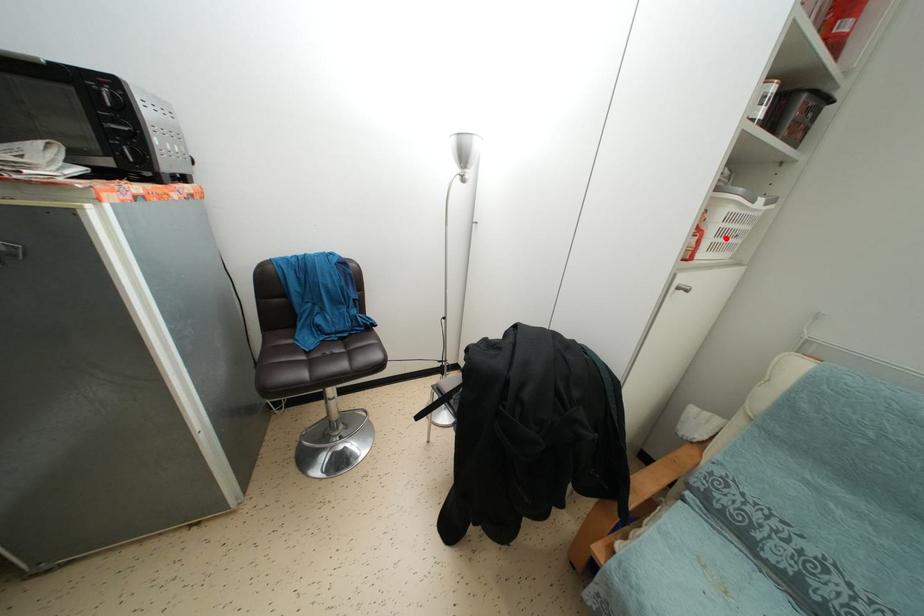
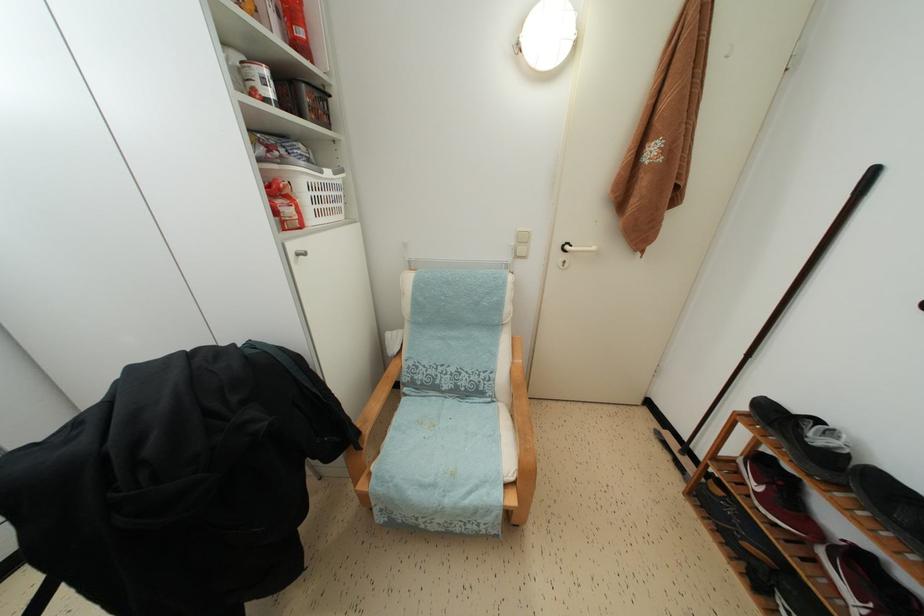
In the second image, find the point that corresponds to the highlighted location in the first image.

(319, 206)